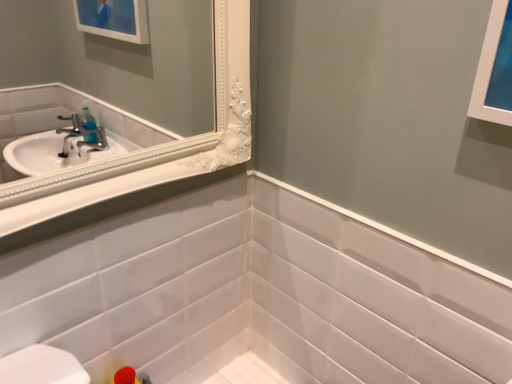
Locate an element on the screen. white glossy tile at center is located at coordinates (254, 295).

Describe the element at coordinates (254, 295) in the screenshot. This screenshot has height=384, width=512. I see `white glossy tile at center` at that location.

This screenshot has height=384, width=512. In order to click on white glossy tile at center in this screenshot , I will do `click(254, 295)`.